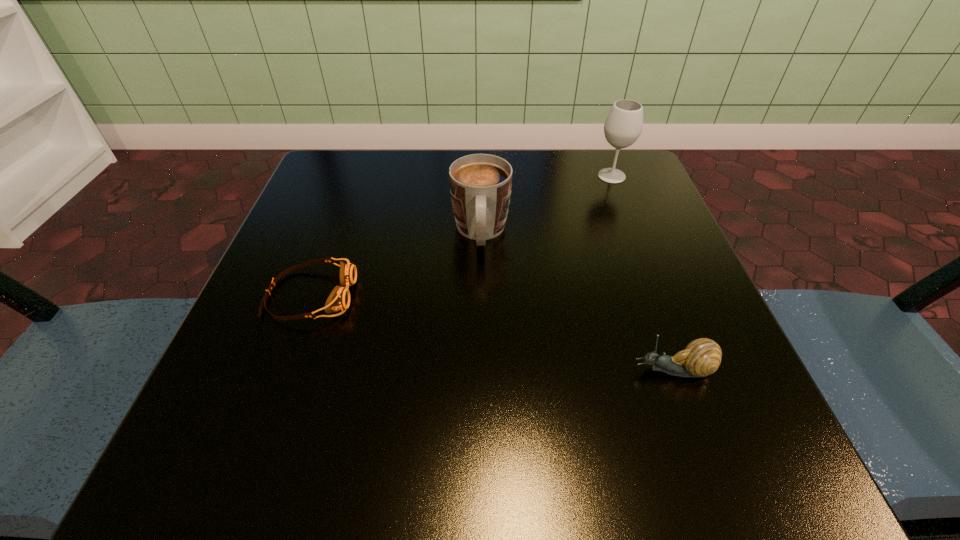
At what (x,y) coordinates should I click in order to perform the action: click on vacant point located on the front-facing side of the escargot. Please return your answer as a coordinate pair (x, y). The image size is (960, 540). Looking at the image, I should click on click(413, 370).

Where is `vacant space situated 0.220m on the front-facing side of the escargot`? This screenshot has width=960, height=540. vacant space situated 0.220m on the front-facing side of the escargot is located at coordinates (476, 370).

Find the location of `vacant space located on the front-facing side of the escargot`. vacant space located on the front-facing side of the escargot is located at coordinates (540, 370).

Where is `free space located 0.080m with the lenses facing forward on the shortest object`? free space located 0.080m with the lenses facing forward on the shortest object is located at coordinates (403, 295).

Where is `wineglass that is at the far edge`? This screenshot has height=540, width=960. wineglass that is at the far edge is located at coordinates pos(623,126).

Where is `mug located in the far edge section of the desktop`? mug located in the far edge section of the desktop is located at coordinates (480, 184).

Locate an element on the screen. The image size is (960, 540). object present at the left edge is located at coordinates (339, 299).

Locate an element on the screen. The image size is (960, 540). wineglass that is at the right edge is located at coordinates (623, 126).

I want to click on escargot located at the right edge, so click(x=701, y=357).

This screenshot has width=960, height=540. I want to click on object that is at the far right corner, so click(623, 126).